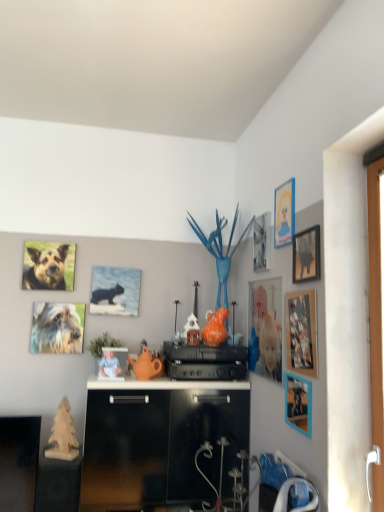
Question: Is matte plastic picture frame at center-right, the third picture frame from the left, at the left side of matte plastic picture frame at center, which is the 7th picture frame from right to left?

Choices:
 (A) no
 (B) yes

Answer: (A)

Question: From a real-world perspective, is matte plastic picture frame at center-right, the third picture frame from the left, positioned over matte plastic picture frame at center, arranged as the second picture frame when viewed from the left, based on gravity?

Choices:
 (A) yes
 (B) no

Answer: (A)

Question: Is matte plastic picture frame at center-right, which is the 6th picture frame in right-to-left order, wider than matte plastic picture frame at center, arranged as the second picture frame when viewed from the left?

Choices:
 (A) no
 (B) yes

Answer: (A)

Question: From the image's perspective, is matte plastic picture frame at center-right, which is the 6th picture frame in right-to-left order, above matte plastic picture frame at center, which is the 7th picture frame from right to left?

Choices:
 (A) yes
 (B) no

Answer: (A)

Question: Would you say matte plastic picture frame at center-right, the third picture frame from the left, contains matte plastic picture frame at center, which is the 7th picture frame from right to left?

Choices:
 (A) yes
 (B) no

Answer: (B)

Question: Is matte plastic picture frame at center-right, which is the 6th picture frame in right-to-left order, in front of matte plastic picture frame at center, arranged as the second picture frame when viewed from the left?

Choices:
 (A) no
 (B) yes

Answer: (B)

Question: From the image's perspective, is metallic silver picture frame at upper right, which is the fourth picture frame from left to right, below wooden picture frame at upper right, which is the eighth picture frame in left-to-right order?

Choices:
 (A) no
 (B) yes

Answer: (A)

Question: Is metallic silver picture frame at upper right, which is the fourth picture frame from left to right, surrounding wooden picture frame at upper right, arranged as the 1th picture frame when viewed from the right?

Choices:
 (A) yes
 (B) no

Answer: (B)

Question: Does metallic silver picture frame at upper right, which is the fourth picture frame from left to right, lie in front of wooden picture frame at upper right, which is the eighth picture frame in left-to-right order?

Choices:
 (A) yes
 (B) no

Answer: (B)

Question: From the image's perspective, does metallic silver picture frame at upper right, which is counted as the fifth picture frame, starting from the right, appear higher than wooden picture frame at upper right, arranged as the 1th picture frame when viewed from the right?

Choices:
 (A) yes
 (B) no

Answer: (A)

Question: Is metallic silver picture frame at upper right, which is counted as the fifth picture frame, starting from the right, outside wooden picture frame at upper right, arranged as the 1th picture frame when viewed from the right?

Choices:
 (A) no
 (B) yes

Answer: (B)

Question: Is metallic silver picture frame at upper right, which is counted as the fifth picture frame, starting from the right, to the left of wooden picture frame at upper right, which is the eighth picture frame in left-to-right order, from the viewer's perspective?

Choices:
 (A) yes
 (B) no

Answer: (A)

Question: Can you confirm if wooden photo frame at right, arranged as the 7th picture frame when viewed from the left, is bigger than white plastic handle at right?

Choices:
 (A) no
 (B) yes

Answer: (A)